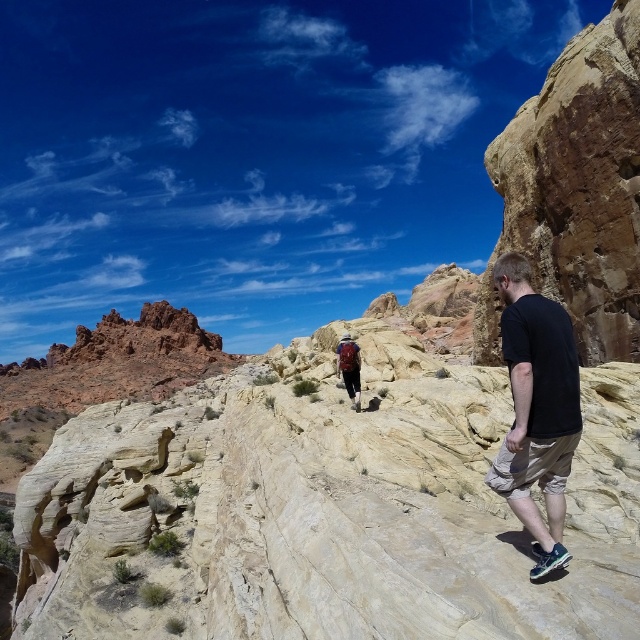
Question: Can you confirm if black cotton t-shirt at right is smaller than matte brown backpack at center?

Choices:
 (A) yes
 (B) no

Answer: (B)

Question: Does black cotton t-shirt at right appear on the left side of matte brown backpack at center?

Choices:
 (A) no
 (B) yes

Answer: (A)

Question: Among these points, which one is nearest to the camera?

Choices:
 (A) (342, 378)
 (B) (563, 525)

Answer: (B)

Question: Which point appears closest to the camera in this image?

Choices:
 (A) (348, 337)
 (B) (550, 497)

Answer: (B)

Question: Which point is farther to the camera?

Choices:
 (A) (358, 378)
 (B) (552, 534)

Answer: (A)

Question: Does black cotton t-shirt at right have a greater width compared to matte brown backpack at center?

Choices:
 (A) no
 (B) yes

Answer: (B)